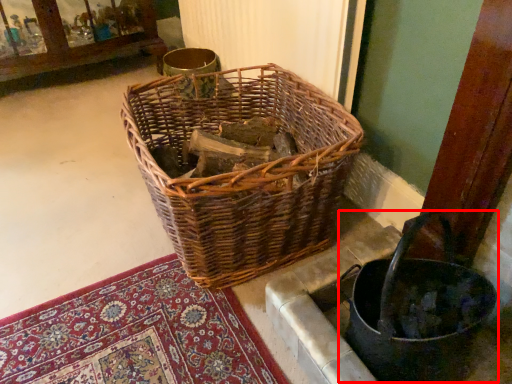
Question: From the image's perspective, what is the correct spatial positioning of basket container (annotated by the red box) in reference to picnic basket?

Choices:
 (A) above
 (B) below

Answer: (B)